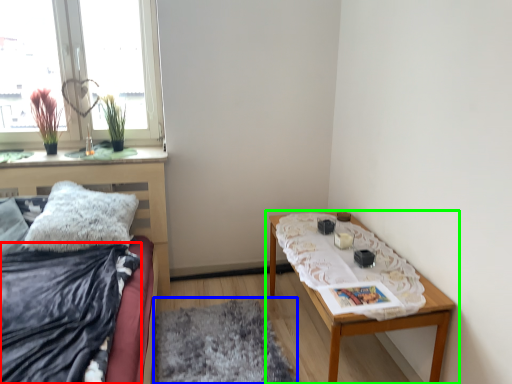
Question: Based on their relative distances, which object is farther from blanket (highlighted by a red box)? Choose from mat (highlighted by a blue box) and table (highlighted by a green box).

Choices:
 (A) mat
 (B) table

Answer: (B)